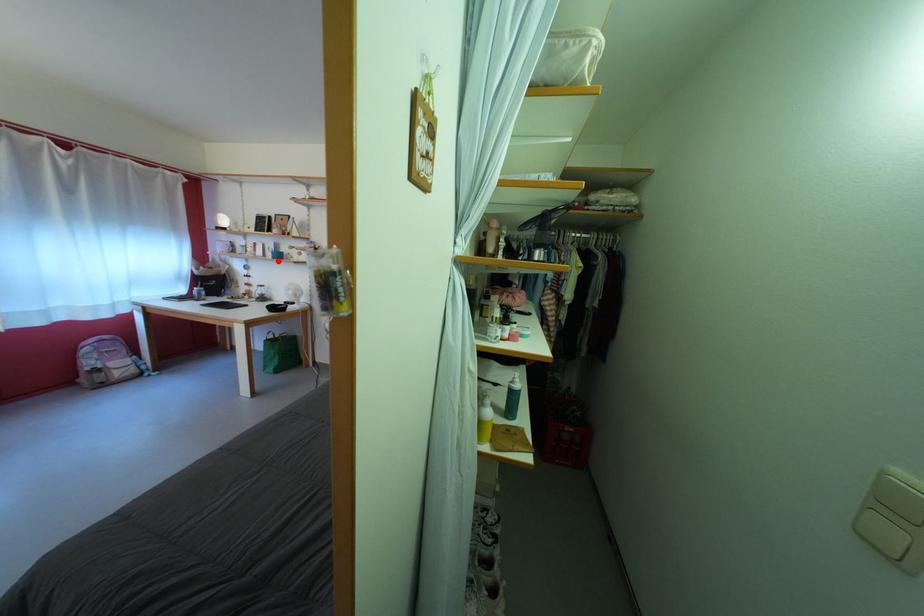
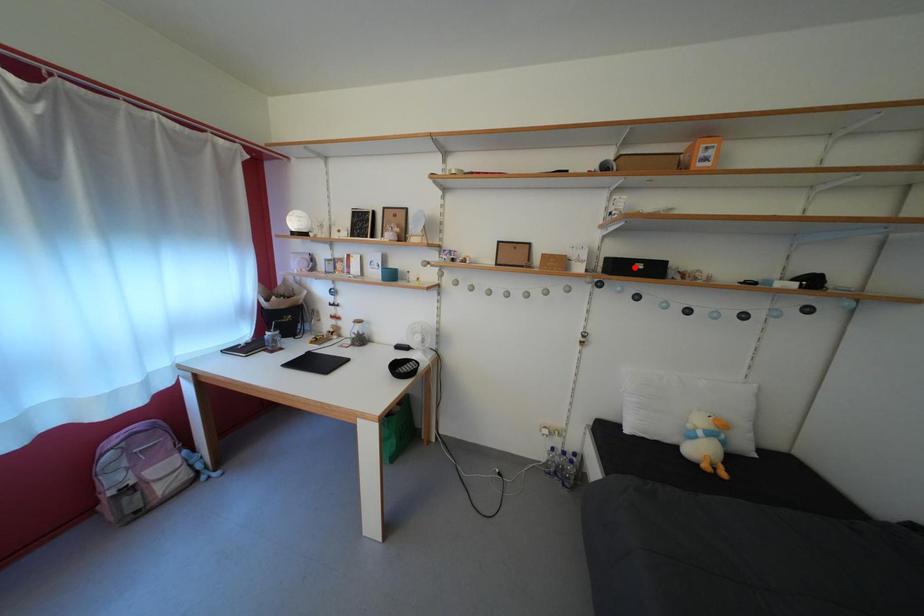
I am providing you with two images of the same scene from different viewpoints. A red point is marked on the first image and another point is marked on the second image. Does the point marked in image1 correspond to the same location as the one in image2?

No